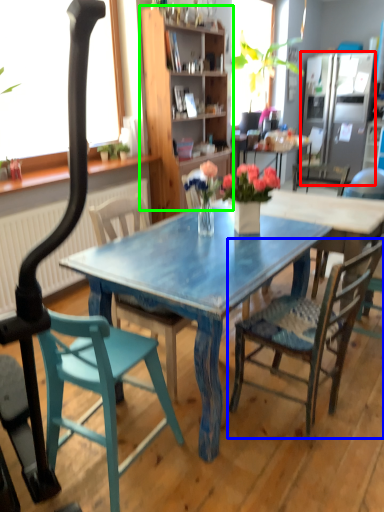
Question: Which object is the farthest from refrigerator (highlighted by a red box)? Choose among these: chair (highlighted by a blue box) or cabinetry (highlighted by a green box).

Choices:
 (A) chair
 (B) cabinetry

Answer: (A)